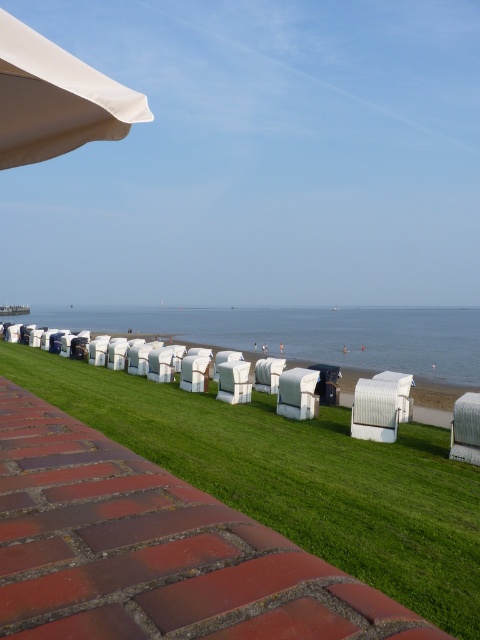
Between green grass at center and blue water at center, which one appears on the left side from the viewer's perspective?

green grass at center is more to the left.

The image size is (480, 640). I want to click on green grass at center, so click(299, 477).

You are a GUI agent. You are given a task and a screenshot of the screen. Output one action in this format:
    pyautogui.click(x=<x>, y=<y>)
    Task: Click on the green grass at center
    The height and width of the screenshot is (640, 480).
    Given the screenshot: What is the action you would take?
    pyautogui.click(x=299, y=477)

Between point (431, 349) and point (35, 90), which one is positioned behind?

Positioned behind is point (431, 349).

Measure the distance between point (x=464, y=387) and camera.

Point (x=464, y=387) is 65.43 feet from camera.

Where is `blue water at center`? This screenshot has width=480, height=640. blue water at center is located at coordinates (312, 339).

Is green grass at center closer to camera compared to white matte umbrella at upper left?

No, it is behind white matte umbrella at upper left.

Between green grass at center and white matte umbrella at upper left, which one has less height?

Standing shorter between the two is white matte umbrella at upper left.

Is point (432, 541) closer to camera compared to point (27, 154)?

No, (432, 541) is further to viewer.

The height and width of the screenshot is (640, 480). I want to click on green grass at center, so pyautogui.click(x=299, y=477).